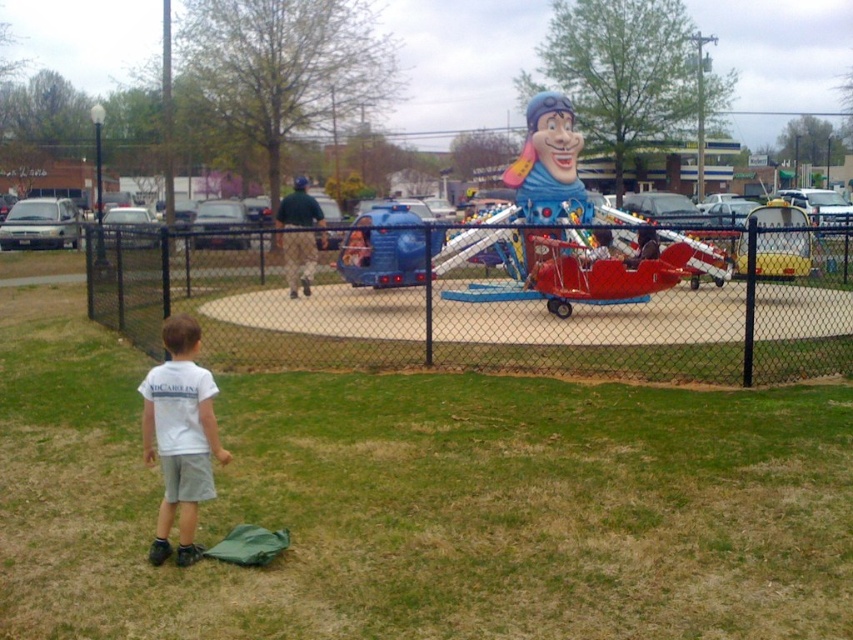
Question: Which of the following is the farthest from the observer?

Choices:
 (A) red plastic airplane at center
 (B) black chain-link fence at center
 (C) white cotton shirt at lower left

Answer: (A)

Question: Does black chain-link fence at center have a smaller size compared to red plastic airplane at center?

Choices:
 (A) yes
 (B) no

Answer: (A)

Question: Can you confirm if red plastic airplane at center is positioned below white cotton shirt at lower left?

Choices:
 (A) yes
 (B) no

Answer: (B)

Question: Which point is farther to the camera?

Choices:
 (A) (193, 364)
 (B) (384, 344)

Answer: (B)

Question: Which point is farther to the camera?

Choices:
 (A) white cotton shirt at lower left
 (B) black chain-link fence at center
 (C) red plastic airplane at center

Answer: (C)

Question: Is black chain-link fence at center above white cotton shirt at lower left?

Choices:
 (A) no
 (B) yes

Answer: (B)